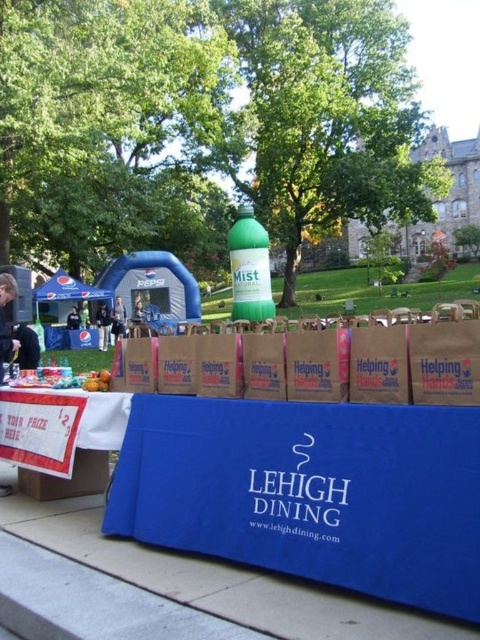
Between point (0, 285) and point (99, 310), which one is positioned behind?

Point (99, 310)

Is matte black jacket at lower left closer to the viewer compared to dark blue jeans at center?

Yes, matte black jacket at lower left is in front of dark blue jeans at center.

This screenshot has height=640, width=480. I want to click on matte black jacket at lower left, so click(6, 321).

Where is `matte black jacket at lower left`? Image resolution: width=480 pixels, height=640 pixels. matte black jacket at lower left is located at coordinates (6, 321).

Which is above, green matte bottle at center or black shirt at left?

green matte bottle at center is above.

From the picture: Does green matte bottle at center appear on the right side of black shirt at left?

Correct, you'll find green matte bottle at center to the right of black shirt at left.

At what (x,y) coordinates should I click in order to perform the action: click on green matte bottle at center. Please return your answer as a coordinate pair (x, y). Looking at the image, I should click on (250, 268).

Does point (219, 593) lie behind point (115, 330)?

No, it is in front of (115, 330).

Which is above, blue fabric table at center or matte black jacket at center?

matte black jacket at center is higher up.

At what (x,y) coordinates should I click in order to perform the action: click on blue fabric table at center. Please return your answer as a coordinate pair (x, y). The height and width of the screenshot is (640, 480). Looking at the image, I should click on (184, 584).